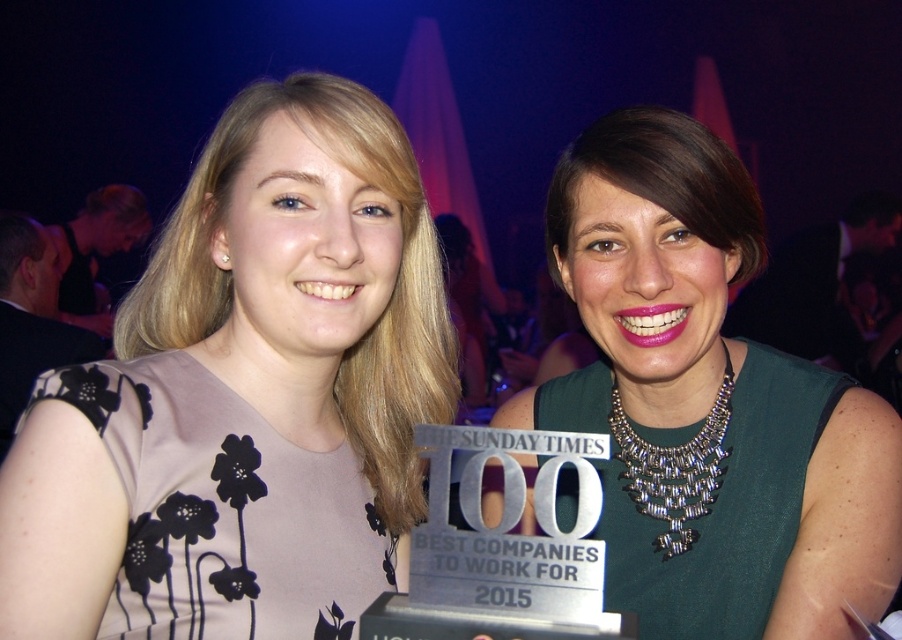
Question: Among these points, which one is nearest to the camera?

Choices:
 (A) (667, 456)
 (B) (601, 244)
 (C) (209, 168)

Answer: (C)

Question: Which object is closer to the camera taking this photo?

Choices:
 (A) pink matte dress at center
 (B) silver metallic necklace at upper center
 (C) green metallic necklace at center

Answer: (A)

Question: Which object appears closest to the camera in this image?

Choices:
 (A) green metallic necklace at center
 (B) silver metallic necklace at upper center
 (C) pink matte dress at center

Answer: (C)

Question: Is green metallic necklace at center thinner than silver metallic necklace at upper center?

Choices:
 (A) yes
 (B) no

Answer: (B)

Question: Considering the relative positions of pink matte dress at center and silver metallic necklace at upper center in the image provided, where is pink matte dress at center located with respect to silver metallic necklace at upper center?

Choices:
 (A) below
 (B) above

Answer: (B)

Question: Does green metallic necklace at center have a larger size compared to silver metallic necklace at upper center?

Choices:
 (A) no
 (B) yes

Answer: (B)